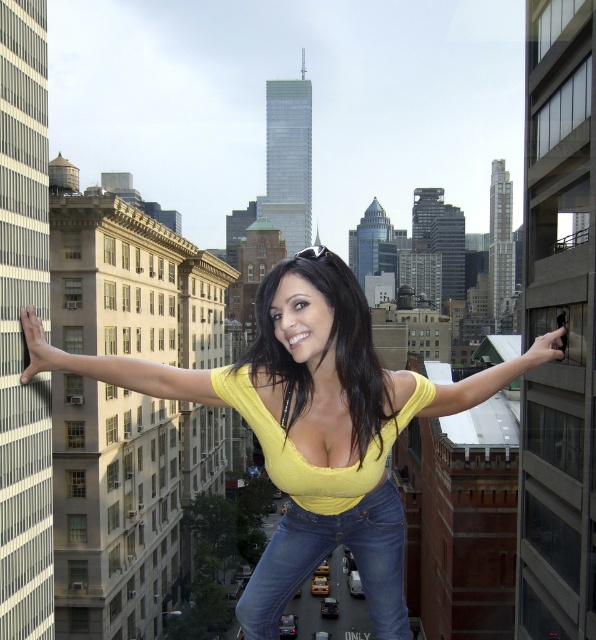
You are standing in the city scene and want to reach the point marked at coordinates (362, 387). If you start walking directly towards it from your current position, how far will you have to walk to reach that point?

The point marked at coordinates (362, 387) is 43.25 meters away from the viewer, so you will have to walk 43.25 meters to reach it.

You are a city planner analyzing the urban layout. You need to place a new green park in the area between the beige buildings on the left and the modern structures on the right. Considering the yellow matte top at center is positioned at point 0.667 on the horizontal axis and 0.523 on the vertical axis, will the park be closer to the beige buildings or the modern structures?

The yellow matte top at center is located at point 0.667 on the horizontal axis. Since the beige buildings are on the left and the modern structures on the right, the park would be closer to the modern structures as 0.667 is closer to the right side of the horizontal axis.

You are a fashion designer analyzing the image of a woman standing between two buildings. You notice her yellow matte top at center and jeans at center. Which clothing item appears taller in the image?

The yellow matte top at center appears taller than the jeans at center in the image.